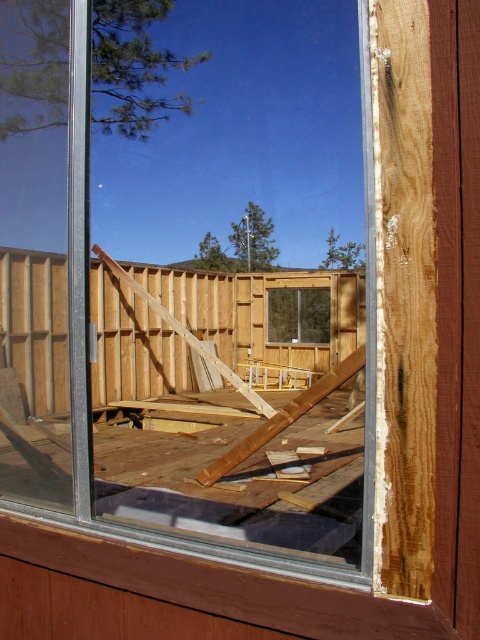
Question: Is transparent glass window at center above clear glass window at center?

Choices:
 (A) no
 (B) yes

Answer: (B)

Question: Observing the image, what is the correct spatial positioning of transparent glass window at center in reference to clear glass window at center?

Choices:
 (A) right
 (B) left

Answer: (B)

Question: Among these points, which one is nearest to the camera?

Choices:
 (A) (213, 368)
 (B) (299, 320)

Answer: (A)

Question: Among these objects, which one is farthest from the camera?

Choices:
 (A) transparent glass window at center
 (B) clear glass window at center

Answer: (B)

Question: Which point is closer to the camera?

Choices:
 (A) transparent glass window at center
 (B) clear glass window at center

Answer: (A)

Question: Can you confirm if transparent glass window at center is positioned to the right of clear glass window at center?

Choices:
 (A) no
 (B) yes

Answer: (A)